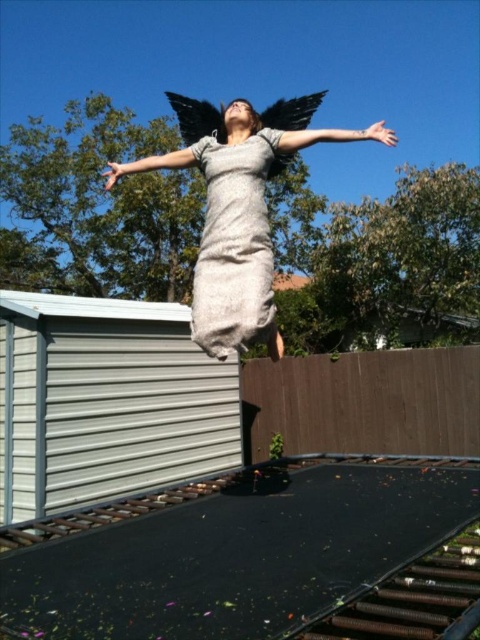
Question: Which point is farther to the camera?

Choices:
 (A) matte gray arm at upper center
 (B) gray textured dress at center
 (C) gray matte dress at center
 (D) black matte wings at upper center

Answer: (D)

Question: Considering the relative positions of gray matte dress at center and black matte wings at upper center in the image provided, where is gray matte dress at center located with respect to black matte wings at upper center?

Choices:
 (A) above
 (B) below

Answer: (B)

Question: Considering the relative positions of black matte wings at upper center and matte gray arm at upper center in the image provided, where is black matte wings at upper center located with respect to matte gray arm at upper center?

Choices:
 (A) left
 (B) right

Answer: (A)

Question: Which point is farther to the camera?

Choices:
 (A) (286, 141)
 (B) (119, 173)
 (C) (229, 108)

Answer: (B)

Question: From the image, what is the correct spatial relationship of gray textured dress at center in relation to black matte wings at upper center?

Choices:
 (A) below
 (B) above

Answer: (A)

Question: Which of the following is the closest to the observer?

Choices:
 (A) gray textured dress at center
 (B) gray matte dress at center

Answer: (B)